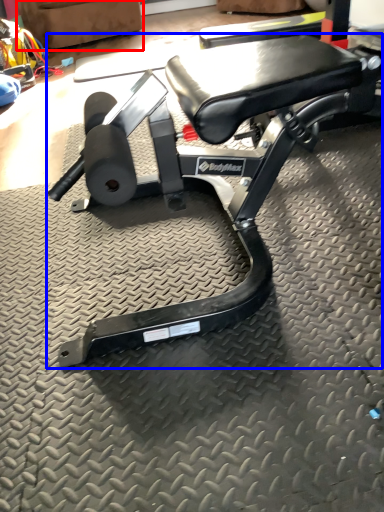
Question: Which point is closer to the camera, swivel chair (highlighted by a red box) or bench (highlighted by a blue box)?

Choices:
 (A) swivel chair
 (B) bench

Answer: (B)